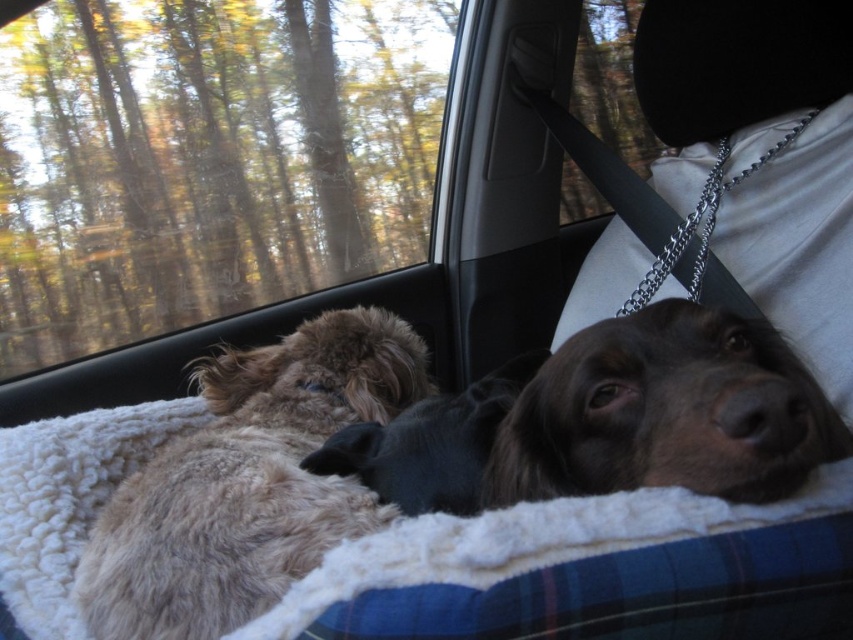
Question: Does transparent glass window at upper left have a larger size compared to brown fuzzy dog at center?

Choices:
 (A) yes
 (B) no

Answer: (A)

Question: Does brown furry dog at center appear over brown fuzzy dog at center?

Choices:
 (A) no
 (B) yes

Answer: (B)

Question: Which of these objects is positioned closest to the fuzzy brown dog at center?

Choices:
 (A) brown fuzzy dog at center
 (B) brown furry dog at center
 (C) transparent glass window at upper left

Answer: (A)

Question: Among these objects, which one is nearest to the camera?

Choices:
 (A) fuzzy brown dog at center
 (B) brown furry dog at center
 (C) brown fuzzy dog at center

Answer: (B)

Question: Is white fleece dog bed at center below brown furry dog at center?

Choices:
 (A) yes
 (B) no

Answer: (A)

Question: Based on their relative distances, which object is farther from the brown fuzzy dog at center?

Choices:
 (A) brown furry dog at center
 (B) white fleece dog bed at center

Answer: (B)